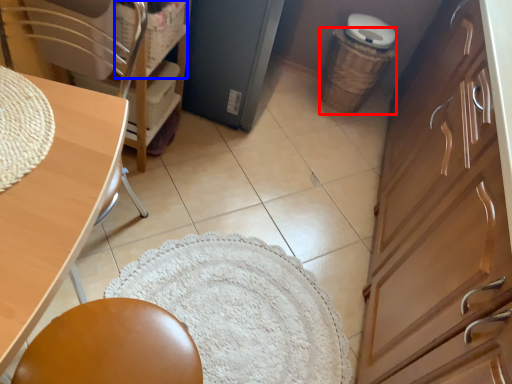
Question: Among these objects, which one is farthest to the camera, basket (highlighted by a red box) or basket (highlighted by a blue box)?

Choices:
 (A) basket
 (B) basket

Answer: (A)